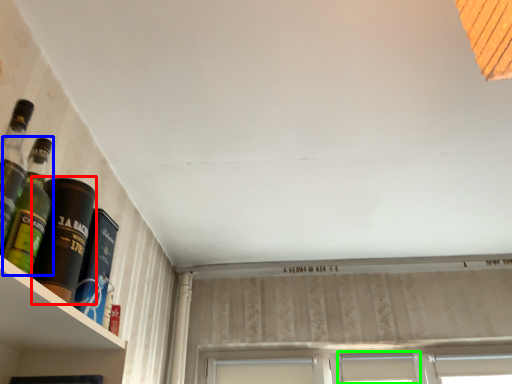
Question: Which is farther away from bottle (highlighted by a red box)? bottle (highlighted by a blue box) or window (highlighted by a green box)?

Choices:
 (A) bottle
 (B) window

Answer: (B)